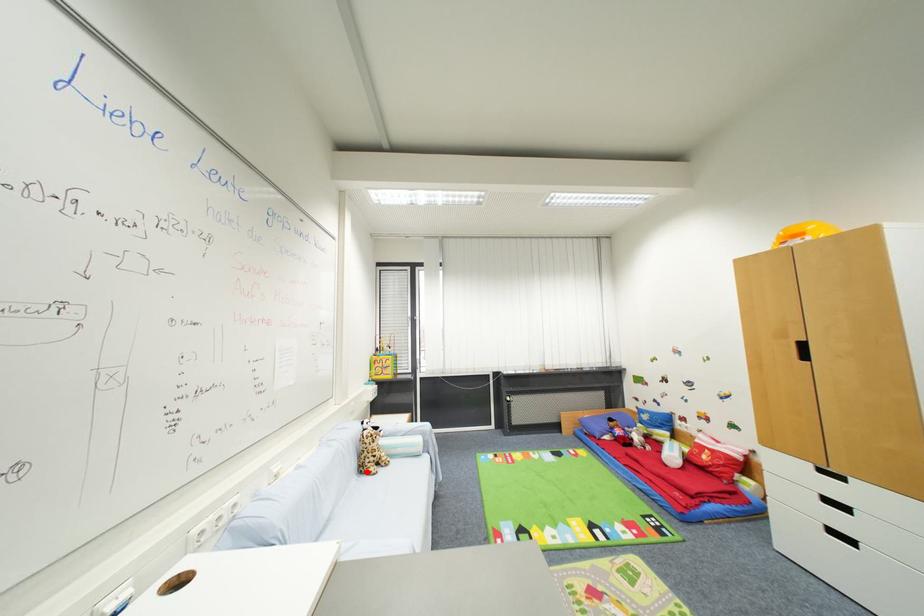
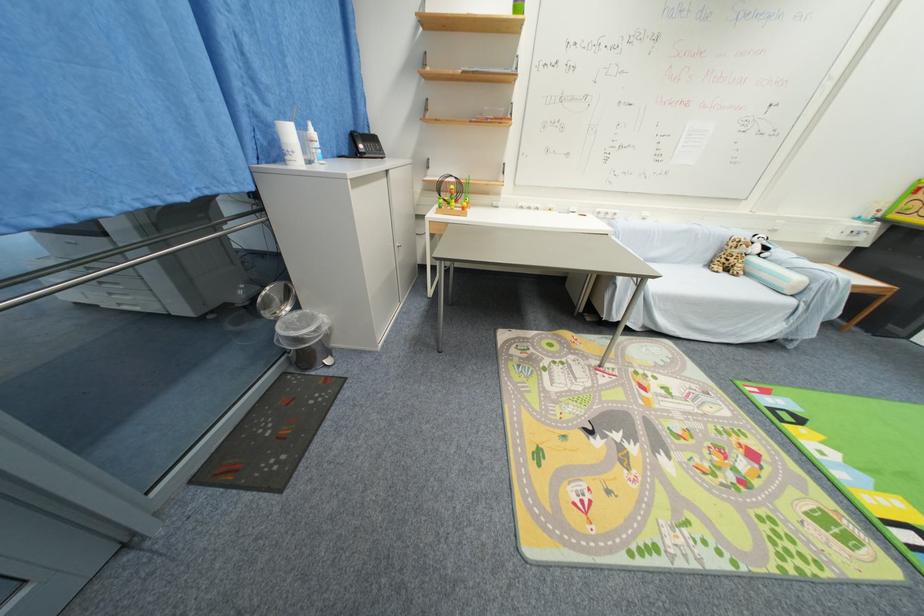
Question: I am providing you with two images of the same scene from different viewpoints. Image1 has a red point marked. In image2, the corresponding 3D location appears at what relative position? Reply with the corresponding letter.

Choices:
 (A) Closer
 (B) Farther

Answer: (A)